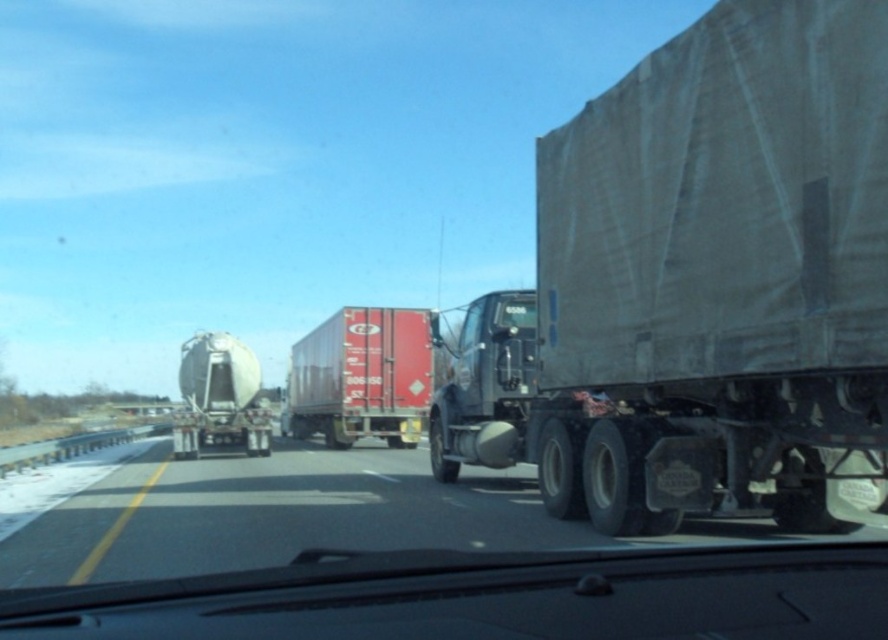
Which is more to the left, red matte container at center or semi-gloss white tanker at center?

From the viewer's perspective, red matte container at center appears more on the left side.

Which is more to the right, red matte container at center or semi-gloss white tanker at center?

From the viewer's perspective, semi-gloss white tanker at center appears more on the right side.

Which is in front, point (331, 403) or point (200, 376)?

Positioned in front is point (200, 376).

Identify the location of red matte container at center. Image resolution: width=888 pixels, height=640 pixels. (361, 378).

Is point (666, 477) in front of point (311, 365)?

Yes, point (666, 477) is in front of point (311, 365).

Can you confirm if gray tarpaulin trailer at right is wider than red matte container at center?

In fact, gray tarpaulin trailer at right might be narrower than red matte container at center.

Where is `gray tarpaulin trailer at right`? The width and height of the screenshot is (888, 640). gray tarpaulin trailer at right is located at coordinates (702, 285).

Is the position of gray tarpaulin trailer at right more distant than that of semi-gloss white tanker at center?

No.

Between gray tarpaulin trailer at right and semi-gloss white tanker at center, which one has less height?

With less height is semi-gloss white tanker at center.

Is point (802, 45) less distant than point (222, 388)?

That is True.

This screenshot has width=888, height=640. Find the location of `gray tarpaulin trailer at right`. gray tarpaulin trailer at right is located at coordinates (702, 285).